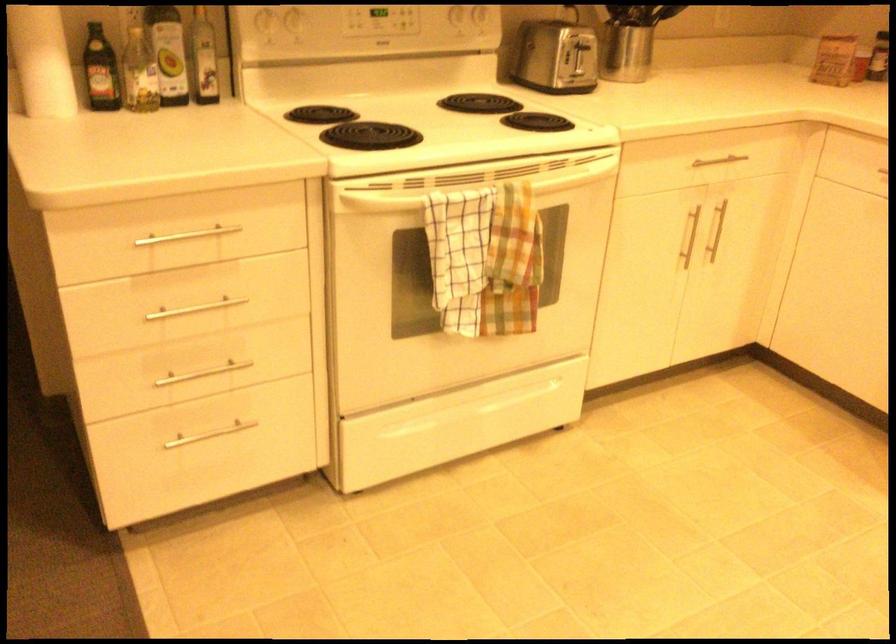
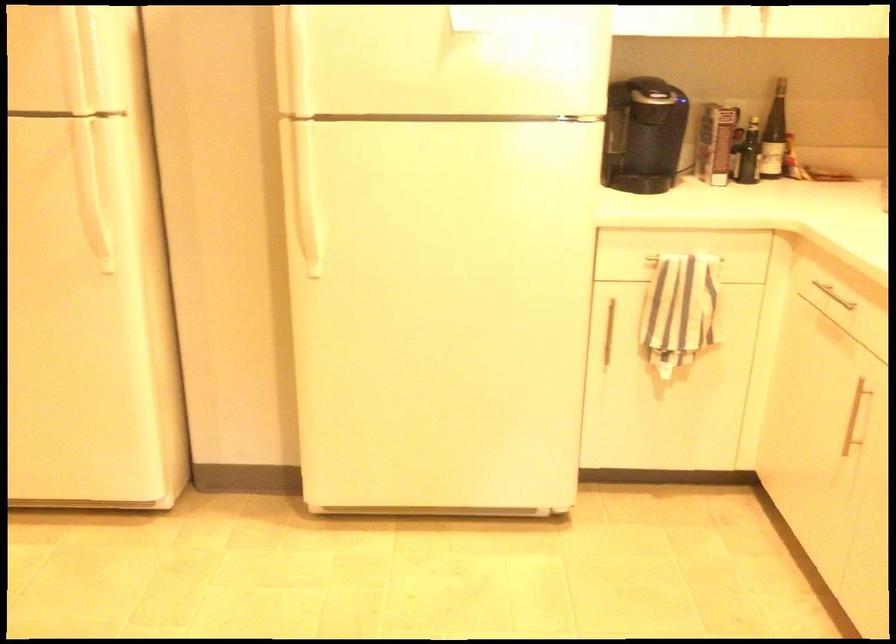
Question: The camera is either moving clockwise (left) or counter-clockwise (right) around the object. The first image is from the beginning of the video and the second image is from the end. Is the camera moving left or right when shooting the video?

Choices:
 (A) Left
 (B) Right

Answer: (A)